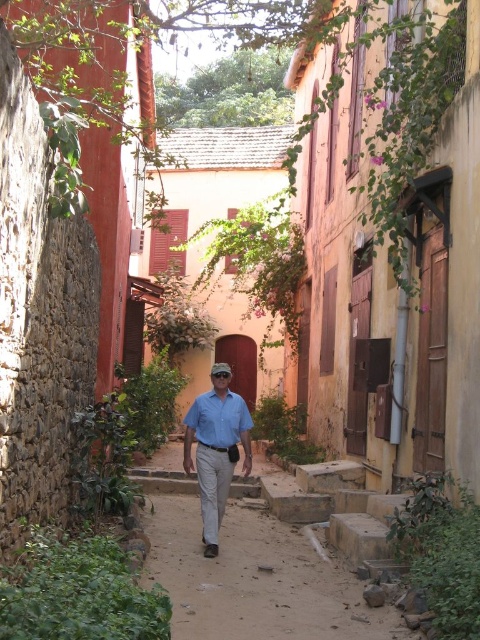
Question: Among these objects, which one is farthest from the camera?

Choices:
 (A) blue cotton shirt at center
 (B) matte blue shirt at center

Answer: (A)

Question: Which of the following is the closest to the observer?

Choices:
 (A) (x=196, y=470)
 (B) (x=218, y=412)

Answer: (B)

Question: Does matte blue shirt at center appear on the right side of blue cotton shirt at center?

Choices:
 (A) yes
 (B) no

Answer: (A)

Question: Can you confirm if matte blue shirt at center is positioned to the left of blue cotton shirt at center?

Choices:
 (A) no
 (B) yes

Answer: (A)

Question: Is matte blue shirt at center bigger than blue cotton shirt at center?

Choices:
 (A) yes
 (B) no

Answer: (A)